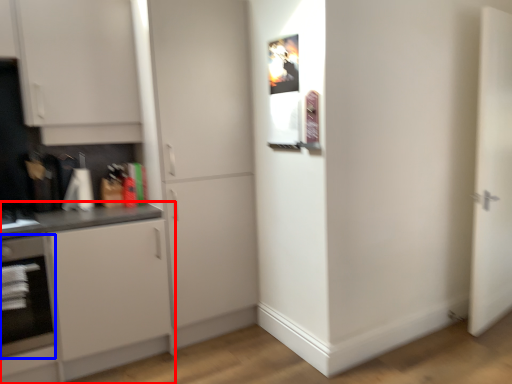
Question: Among these objects, which one is farthest to the camera, cabinetry (highlighted by a red box) or oven (highlighted by a blue box)?

Choices:
 (A) cabinetry
 (B) oven

Answer: (B)